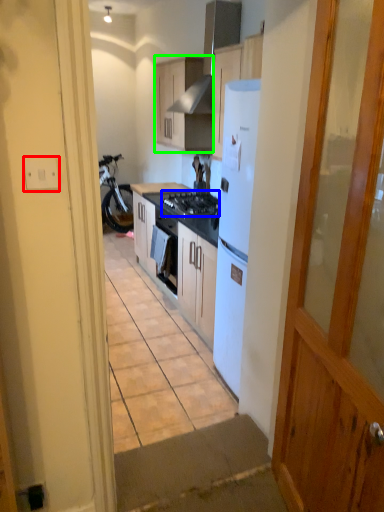
Question: Considering the real-world distances, which object is farthest from electric outlet (highlighted by a red box)? gas stove (highlighted by a blue box) or cabinetry (highlighted by a green box)?

Choices:
 (A) gas stove
 (B) cabinetry

Answer: (B)